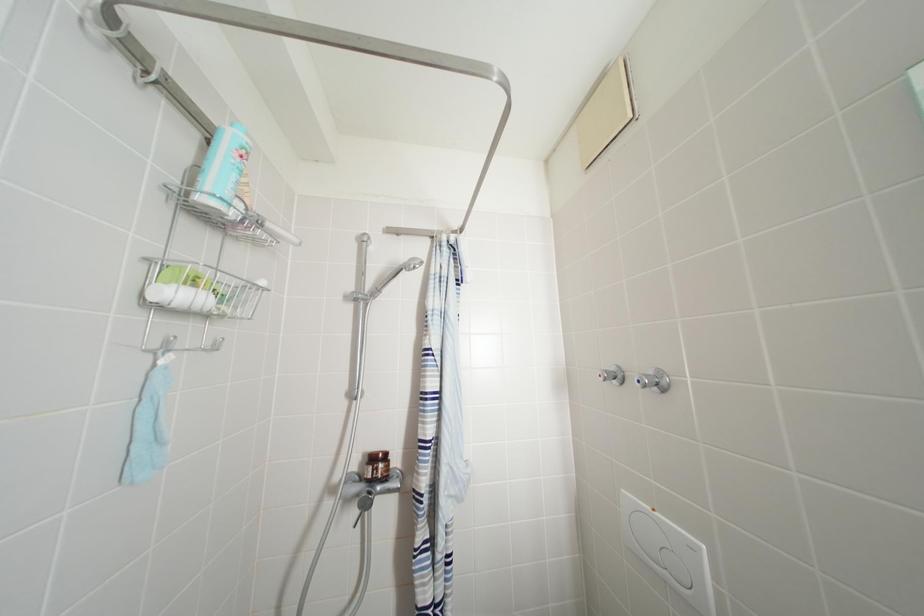
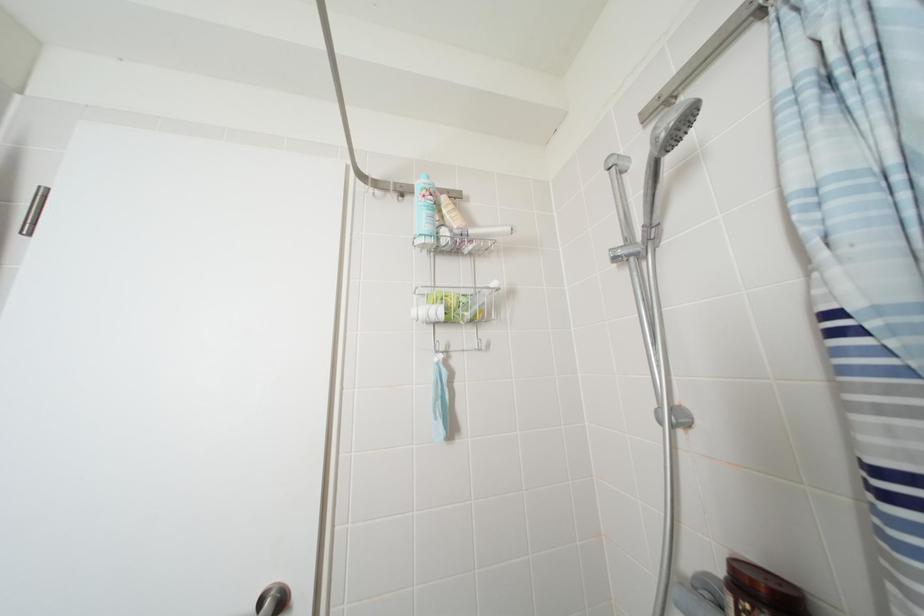
Question: The first image is from the beginning of the video and the second image is from the end. How did the camera likely rotate when shooting the video?

Choices:
 (A) Left
 (B) Right
 (C) Up
 (D) Down

Answer: (A)